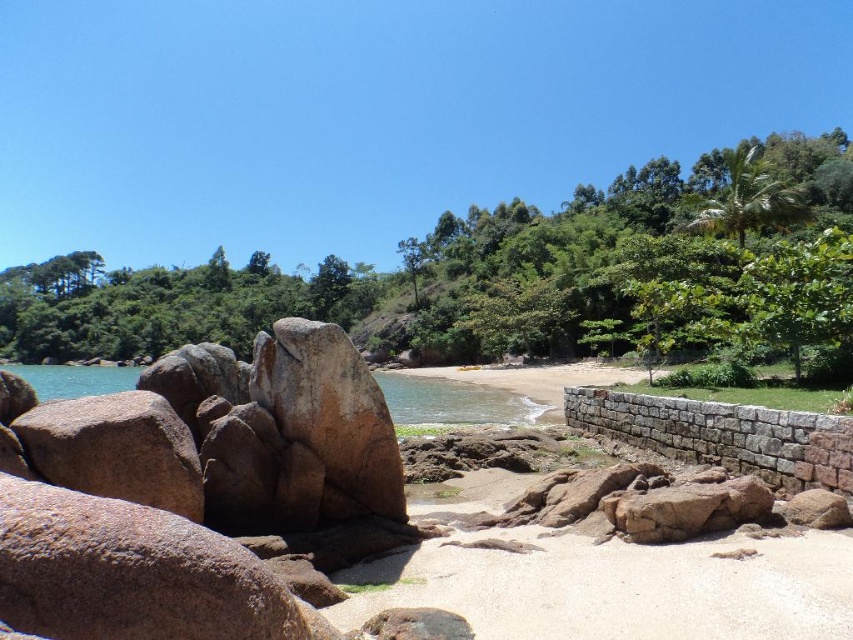
Question: Can you confirm if brown granite rock formation at center is positioned above clear blue water at center left?

Choices:
 (A) no
 (B) yes

Answer: (B)

Question: Does brown granite rock formation at center have a lesser width compared to clear blue water at center left?

Choices:
 (A) yes
 (B) no

Answer: (A)

Question: Considering the real-world distances, which object is closest to the brown granite rock formation at center?

Choices:
 (A) clear water at beach center
 (B) clear blue water at center left

Answer: (A)

Question: Observing the image, what is the correct spatial positioning of light brown sand at center in reference to clear blue water at center left?

Choices:
 (A) left
 (B) right

Answer: (B)

Question: Which object is the farthest from the clear blue water at center left?

Choices:
 (A) clear water at beach center
 (B) brown granite rock formation at center
 (C) light brown sand at center

Answer: (C)

Question: Which point appears closest to the camera in this image?

Choices:
 (A) (473, 397)
 (B) (96, 388)

Answer: (A)